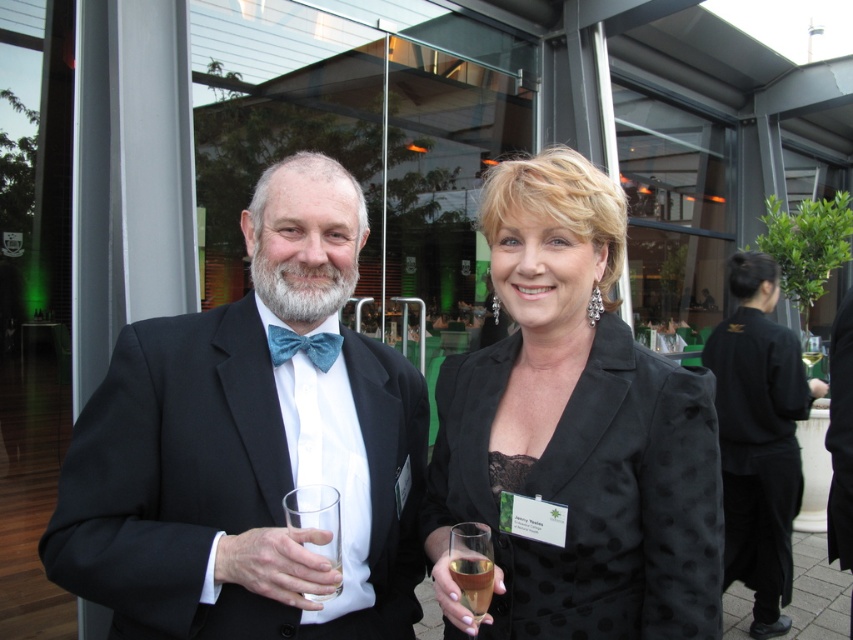
You are standing at the entrance of the building and want to see the translucent glass at lower center. In which direction should you look to find it?

The translucent glass at lower center is located at point (473, 566), so you should look towards the lower center direction to find it.

In the scene shown: You are a photographer at a formal event. You want to take a photo of the black satin suit at center and the clear glass at center. Which object is closer to you so that you can focus on it first?

The black satin suit at center is closer to you than the clear glass at center, so you can focus on it first.